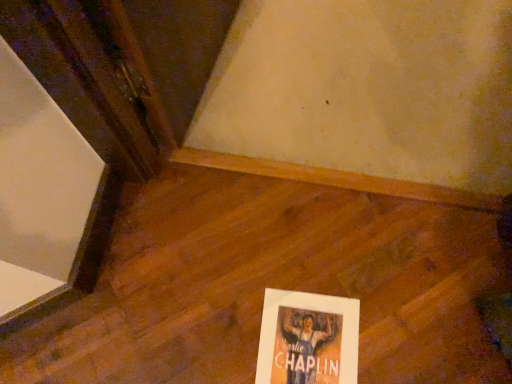
Find the location of a particular element. The width and height of the screenshot is (512, 384). wooden floor at center is located at coordinates (270, 284).

The height and width of the screenshot is (384, 512). What do you see at coordinates (270, 284) in the screenshot? I see `wooden floor at center` at bounding box center [270, 284].

I want to click on matte paper poster at lower right, so click(x=308, y=339).

Measure the distance between point (349,353) and camera.

Point (349,353) and camera are 35.83 inches apart.

The image size is (512, 384). Describe the element at coordinates (308, 339) in the screenshot. I see `matte paper poster at lower right` at that location.

Image resolution: width=512 pixels, height=384 pixels. Identify the location of wooden floor at center. (270, 284).

In the scene shown: Between matte paper poster at lower right and wooden floor at center, which one appears on the left side from the viewer's perspective?

From the viewer's perspective, wooden floor at center appears more on the left side.

Which object is closer to the camera, matte paper poster at lower right or wooden floor at center?

wooden floor at center is more forward.

Is point (326, 312) positioned before point (298, 286)?

Yes, point (326, 312) is in front of point (298, 286).

From the image's perspective, is matte paper poster at lower right located beneath wooden floor at center?

Yes, from the image's perspective, matte paper poster at lower right is beneath wooden floor at center.

From a real-world perspective, is matte paper poster at lower right physically below wooden floor at center?

Yes, from a real-world perspective, matte paper poster at lower right is below wooden floor at center.

Can you confirm if matte paper poster at lower right is wider than wooden floor at center?

No, matte paper poster at lower right is not wider than wooden floor at center.

Which of these two, matte paper poster at lower right or wooden floor at center, stands taller?

With more height is wooden floor at center.

Can you confirm if matte paper poster at lower right is smaller than wooden floor at center?

Yes.

Is wooden floor at center completely or partially inside matte paper poster at lower right?

No, wooden floor at center is not surrounded by matte paper poster at lower right.

Consider the image. Is matte paper poster at lower right not close to wooden floor at center?

No, matte paper poster at lower right is in close proximity to wooden floor at center.

Is matte paper poster at lower right positioned with its back to wooden floor at center?

Yes.

How different are the orientations of matte paper poster at lower right and wooden floor at center in degrees?

There is a 1.92-degree angle between the facing directions of matte paper poster at lower right and wooden floor at center.

This screenshot has width=512, height=384. In order to click on plywood located on the left of matte paper poster at lower right in this screenshot , I will do `click(270, 284)`.

Which is more to the right, wooden floor at center or matte paper poster at lower right?

From the viewer's perspective, matte paper poster at lower right appears more on the right side.

Which object is further away from the camera taking this photo, wooden floor at center or matte paper poster at lower right?

Positioned behind is matte paper poster at lower right.

In the scene shown: Which point is more distant from viewer, (410, 347) or (349, 335)?

The point (349, 335) is farther from the camera.

Based on the photo, from the image's perspective, is wooden floor at center beneath matte paper poster at lower right?

Incorrect, from the image's perspective, wooden floor at center is higher than matte paper poster at lower right.

From a real-world perspective, is wooden floor at center beneath matte paper poster at lower right?

Actually, wooden floor at center is physically above matte paper poster at lower right in the real world.

Can you confirm if wooden floor at center is wider than matte paper poster at lower right?

Correct, the width of wooden floor at center exceeds that of matte paper poster at lower right.

Between wooden floor at center and matte paper poster at lower right, which one has more height?

wooden floor at center is taller.

In terms of size, does wooden floor at center appear bigger or smaller than matte paper poster at lower right?

wooden floor at center is bigger than matte paper poster at lower right.

Would you say wooden floor at center is outside matte paper poster at lower right?

wooden floor at center is positioned outside matte paper poster at lower right.

Is wooden floor at center next to matte paper poster at lower right and touching it?

No, wooden floor at center is not making contact with matte paper poster at lower right.

Is wooden floor at center aimed at matte paper poster at lower right?

Yes, wooden floor at center is facing matte paper poster at lower right.

Can you tell me how much wooden floor at center and matte paper poster at lower right differ in facing direction?

wooden floor at center and matte paper poster at lower right are facing 1.92 degrees away from each other.

Where is `poster located below the wooden floor at center (from the image's perspective)`? poster located below the wooden floor at center (from the image's perspective) is located at coordinates (308, 339).

Image resolution: width=512 pixels, height=384 pixels. In order to click on plywood in front of the matte paper poster at lower right in this screenshot , I will do `click(270, 284)`.

What are the coordinates of `poster that is behind the wooden floor at center` in the screenshot? It's located at (308, 339).